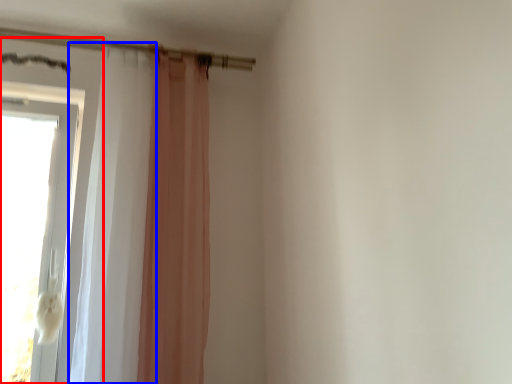
Question: Among these objects, which one is nearest to the camera, door (highlighted by a red box) or shower curtain (highlighted by a blue box)?

Choices:
 (A) door
 (B) shower curtain

Answer: (B)